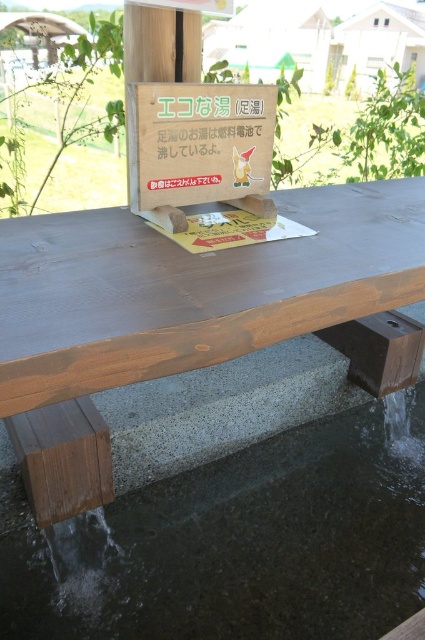
Question: Which point appears farthest from the camera in this image?

Choices:
 (A) (297, 500)
 (B) (167, 312)

Answer: (A)

Question: Is clear concrete water at lower center further to camera compared to stained wood picnic table at center?

Choices:
 (A) no
 (B) yes

Answer: (B)

Question: Can you confirm if clear concrete water at lower center is smaller than stained wood picnic table at center?

Choices:
 (A) no
 (B) yes

Answer: (B)

Question: From the image, what is the correct spatial relationship of clear concrete water at lower center in relation to stained wood picnic table at center?

Choices:
 (A) right
 (B) left

Answer: (A)

Question: Which point is closer to the camera?

Choices:
 (A) clear concrete water at lower center
 (B) stained wood picnic table at center

Answer: (B)